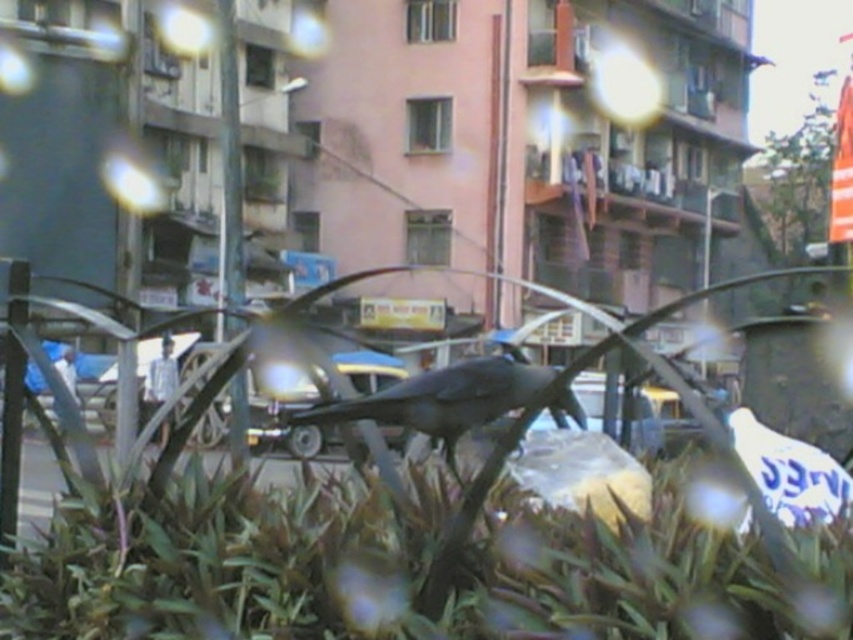
Question: Does green leafy plant at center appear on the left side of shiny black bird at center?

Choices:
 (A) no
 (B) yes

Answer: (B)

Question: Which point is closer to the camera?

Choices:
 (A) shiny black bird at center
 (B) green leafy plant at center

Answer: (B)

Question: Can you confirm if green leafy plant at center is bigger than shiny black bird at center?

Choices:
 (A) no
 (B) yes

Answer: (B)

Question: Does green leafy plant at center appear over shiny black bird at center?

Choices:
 (A) yes
 (B) no

Answer: (B)

Question: Among these points, which one is farthest from the camera?

Choices:
 (A) (78, 576)
 (B) (480, 419)

Answer: (A)

Question: Which point is farther from the camera taking this photo?

Choices:
 (A) (500, 365)
 (B) (569, 568)

Answer: (A)